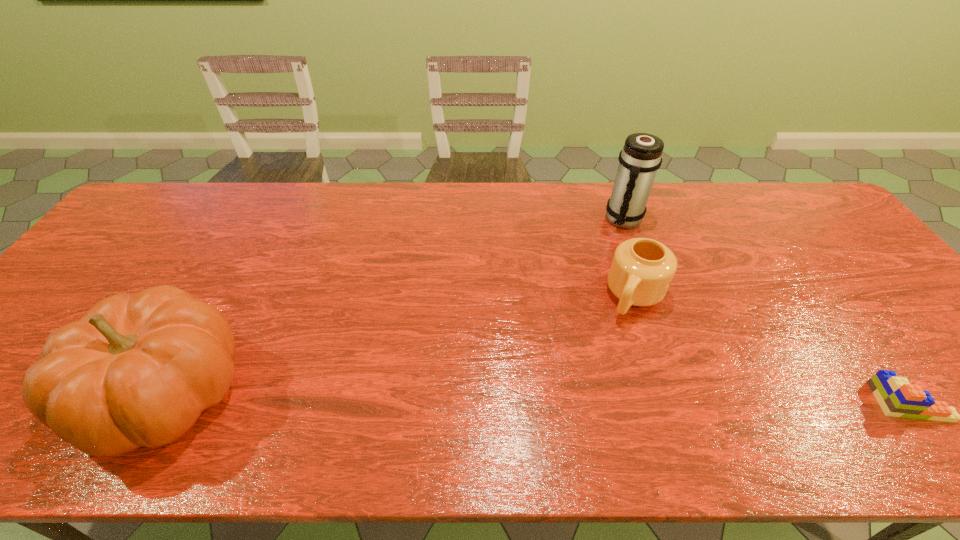
At what (x,y) coordinates should I click in order to perform the action: click on free space between the rightmost object and the mug. Please return your answer as a coordinate pair (x, y). The height and width of the screenshot is (540, 960). Looking at the image, I should click on (772, 349).

The width and height of the screenshot is (960, 540). I want to click on blank region between the pumpkin and the farthest object, so click(x=396, y=306).

Find the location of `the closest object to the pumpkin`. the closest object to the pumpkin is located at coordinates (642, 269).

Find the location of a particular element. Image resolution: width=960 pixels, height=540 pixels. object that stands as the third closest to the thermos bottle is located at coordinates (137, 370).

At what (x,y) coordinates should I click in order to perform the action: click on free location that satisfies the following two spatial constraints: 1. on the front side of the third nearest object; 2. on the right side of the shortest object. Please return your answer as a coordinate pair (x, y). This screenshot has height=540, width=960. Looking at the image, I should click on (670, 401).

Locate an element on the screen. The height and width of the screenshot is (540, 960). vacant point that satisfies the following two spatial constraints: 1. on the back side of the second farthest object; 2. on the right side of the thermos bottle is located at coordinates (611, 220).